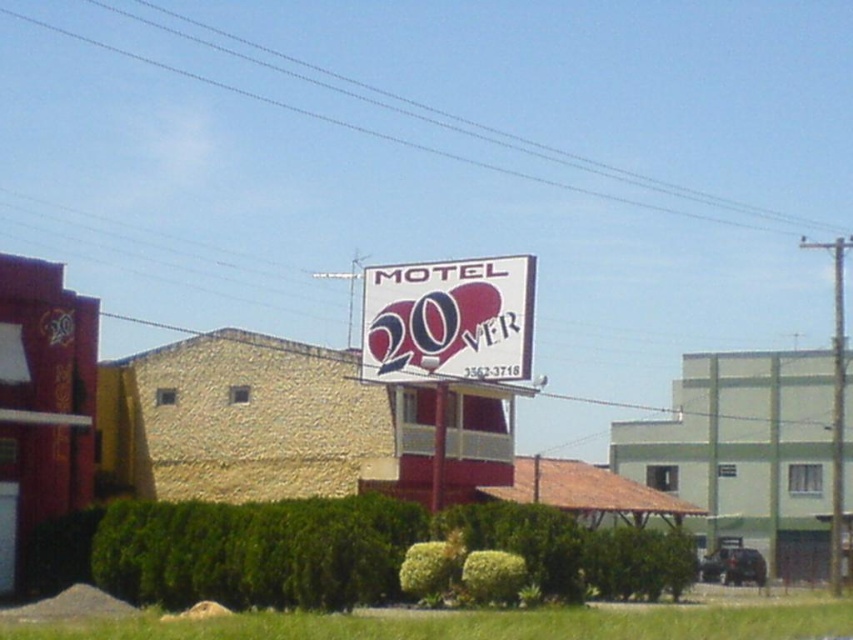
You are standing at a viewpoint where the motel sign is clearly visible. You want to take a photo of the point at coordinates point [532,292]. If your camera has a maximum focus range of 30 meters, will it be able to focus on that point?

The distance of point [532,292] from the camera is 30.12 meters, which exceeds the camera maximum focus range of 30 meters. Therefore, the camera cannot focus on that point.

You are a delivery driver who needs to park your truck near the motel sign. The truck requires a parking space that is at least 10 feet wide. Based on the scene, can you determine if the area between the white plastic sign at center and the white plastic pole at center is wide enough for your truck?

The area between the white plastic sign at center and the white plastic pole at center is 6.20 feet, which is less than the required 10 feet for the truck. Therefore, the space is not wide enough for parking.